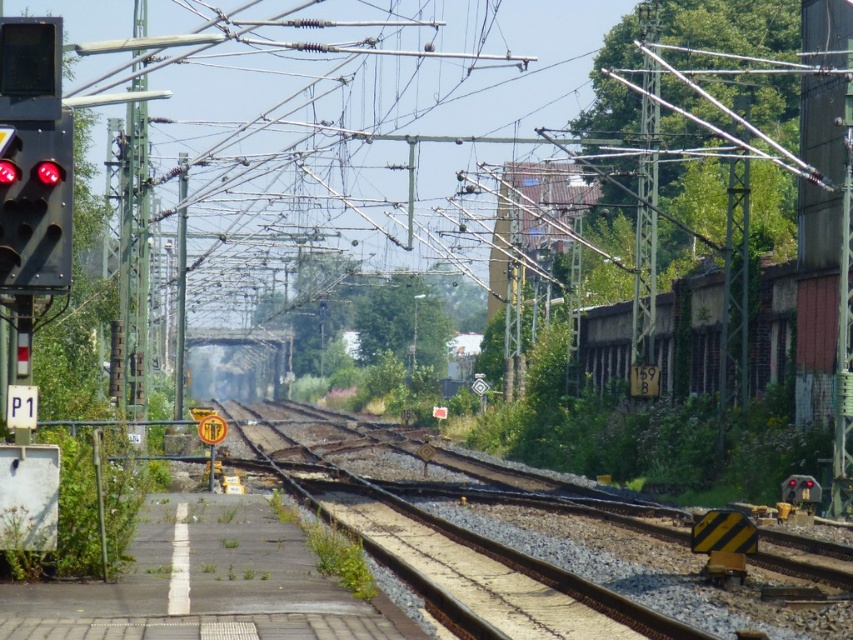
You are standing on the platform and see the point marked at coordinates (468,534). What does this point indicate?

The point at coordinates (468,534) indicates the brown gravel train track at center.